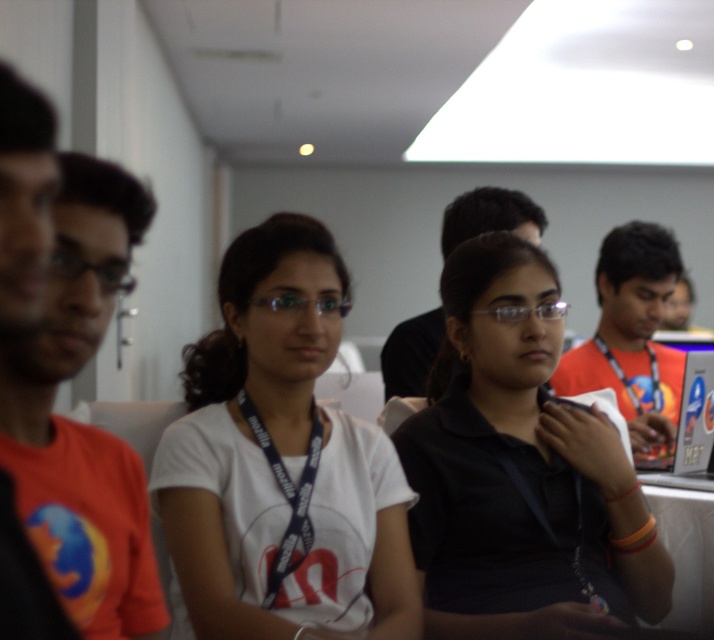
Is black matte shirt at center closer to camera compared to orange fabric shirt at left?

That is False.

Describe the element at coordinates (521, 470) in the screenshot. I see `black matte shirt at center` at that location.

Where is `black matte shirt at center`? black matte shirt at center is located at coordinates (521, 470).

This screenshot has width=714, height=640. In order to click on black matte shirt at center in this screenshot , I will do 521,470.

Does point (176, 484) come farther from viewer compared to point (146, 598)?

Yes.

Between point (216, 564) and point (85, 608), which one is positioned behind?

Positioned behind is point (216, 564).

The image size is (714, 640). Identify the location of white matte t-shirt at center. click(x=281, y=460).

Where is `white matte t-shirt at center`? The image size is (714, 640). white matte t-shirt at center is located at coordinates (281, 460).

Is orange fabric shirt at left positioned at the back of black lanyard at center?

That is False.

How far apart are orange fabric shirt at left and black lanyard at center?

orange fabric shirt at left and black lanyard at center are 1.46 meters apart from each other.

Which is in front, point (136, 212) or point (383, 342)?

Point (136, 212) is more forward.

This screenshot has width=714, height=640. In order to click on orange fabric shirt at left in this screenshot , I will do `click(74, 291)`.